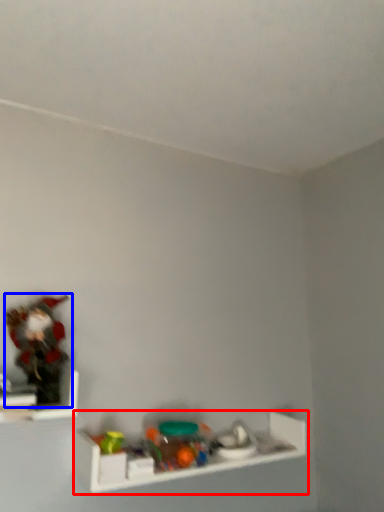
Question: Which of the following is the closest to the observer, shelf (highlighted by a red box) or toy (highlighted by a blue box)?

Choices:
 (A) shelf
 (B) toy

Answer: (B)